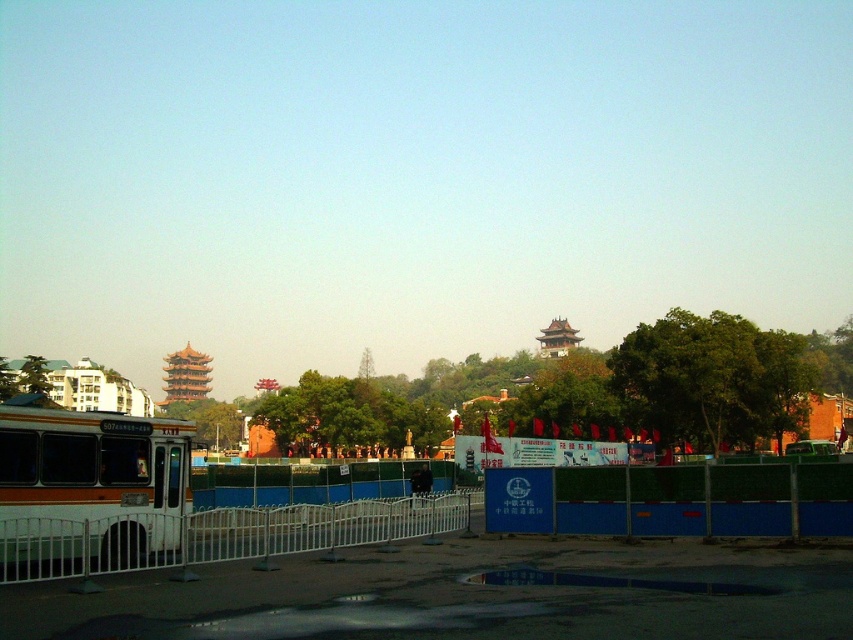
Question: Is orange matte bus at lower left to the right of blue fabric fence at center from the viewer's perspective?

Choices:
 (A) no
 (B) yes

Answer: (A)

Question: Which is nearer to the orange matte bus at lower left?

Choices:
 (A) white metal fence at lower left
 (B) blue fabric fence at center

Answer: (A)

Question: Which object is positioned closest to the blue fabric fence at center?

Choices:
 (A) orange matte bus at lower left
 (B) white metal fence at lower left

Answer: (B)

Question: From the image, what is the correct spatial relationship of blue fabric fence at center in relation to white metal fence at lower left?

Choices:
 (A) below
 (B) above

Answer: (B)

Question: Is orange matte bus at lower left to the right of white metal fence at lower left from the viewer's perspective?

Choices:
 (A) yes
 (B) no

Answer: (B)

Question: Which object is positioned farthest from the orange matte bus at lower left?

Choices:
 (A) white metal fence at lower left
 (B) blue fabric fence at center

Answer: (B)